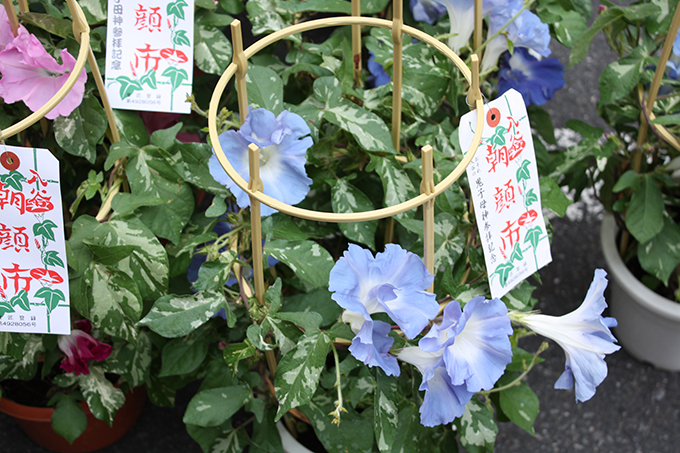
Identify the location of white pots. (664, 331), (292, 444).